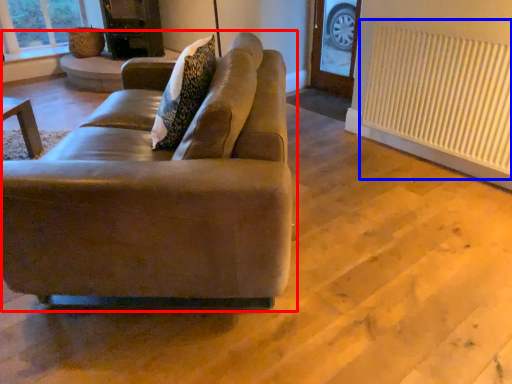
Question: Which point is further to the camera, studio couch (highlighted by a red box) or radiator (highlighted by a blue box)?

Choices:
 (A) studio couch
 (B) radiator

Answer: (B)